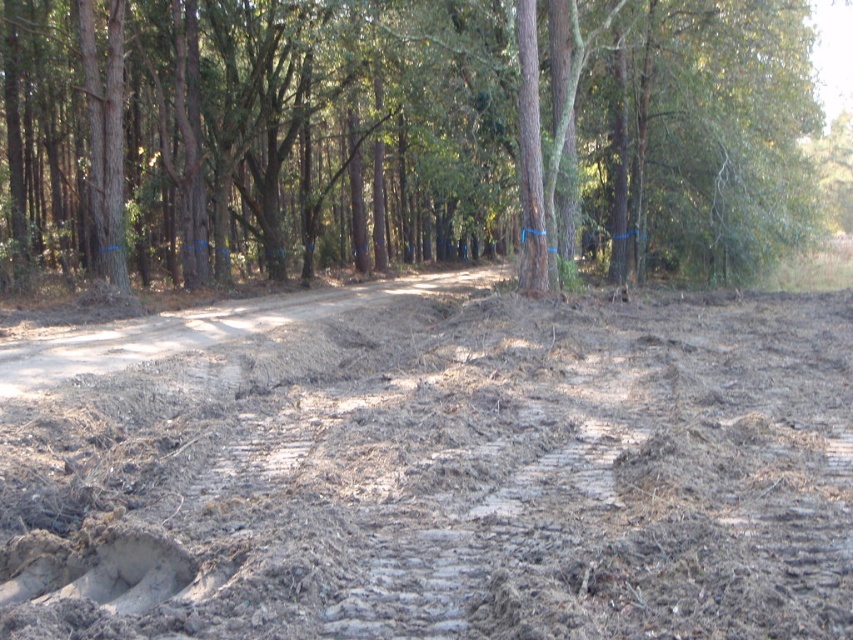
Who is positioned more to the right, dull brown mud at center or dirt road at center?

dull brown mud at center

Who is taller, dull brown mud at center or dirt road at center?

Standing taller between the two is dirt road at center.

What do you see at coordinates (436, 472) in the screenshot? The height and width of the screenshot is (640, 853). I see `dull brown mud at center` at bounding box center [436, 472].

At what (x,y) coordinates should I click in order to perform the action: click on dull brown mud at center. Please return your answer as a coordinate pair (x, y). The width and height of the screenshot is (853, 640). Looking at the image, I should click on (436, 472).

Is the position of dull brown mud at center more distant than that of brown rough tree at center?

No, dull brown mud at center is in front of brown rough tree at center.

Which is more to the left, dull brown mud at center or brown rough tree at center?

From the viewer's perspective, dull brown mud at center appears more on the left side.

What do you see at coordinates (436, 472) in the screenshot? I see `dull brown mud at center` at bounding box center [436, 472].

What are the coordinates of `dull brown mud at center` in the screenshot? It's located at (436, 472).

Is the position of brown rough tree at center less distant than that of dirt road at center?

No.

Can you confirm if brown rough tree at center is wider than dirt road at center?

Correct, the width of brown rough tree at center exceeds that of dirt road at center.

Is point (32, 220) positioned after point (224, 333)?

Yes, point (32, 220) is farther from viewer.

Where is `brown rough tree at center`? brown rough tree at center is located at coordinates (405, 134).